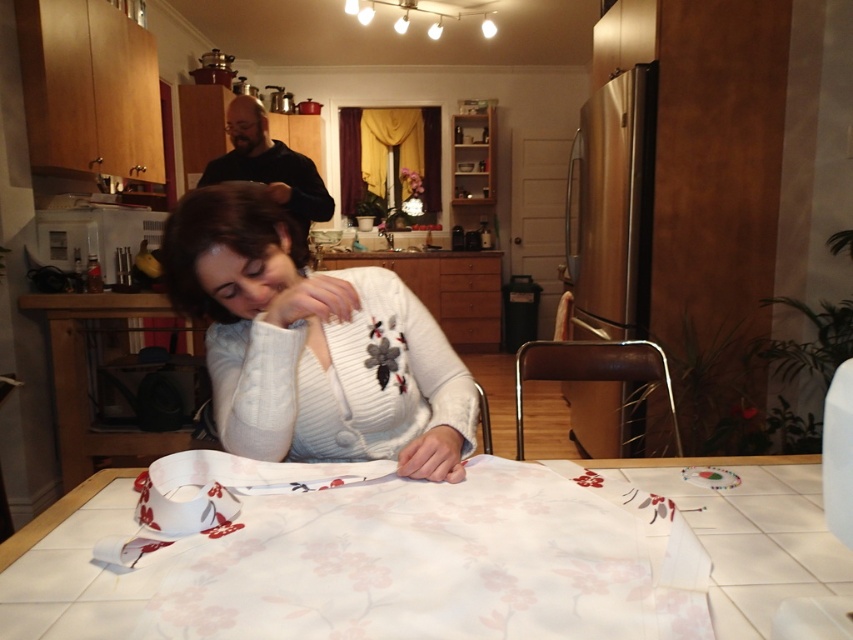
You are organizing a small craft fair and need to display two items on a table. You have a white knit sweater at center and a white fabric at center. If you want to arrange them so that the larger item is placed first, which one should you place first?

The white knit sweater at center is larger in size than the white fabric at center, so you should place the white knit sweater at center first.

Based on the photo, you are a guest in the kitchen and want to place a small decorative item on the table. Which object, the white knit sweater at center or the white fabric at center, would allow you to place the item on top without it falling off?

The white knit sweater at center is taller than the white fabric at center, so placing the item on the white knit sweater at center would be more stable and prevent it from falling off.

You are standing in the kitchen and want to reach both the point at coordinates point (242, 381) and the point at coordinates point (32, 618). Which point will you reach first?

You will reach point (32, 618) first because it is closer to you than point (242, 381), which is further away.